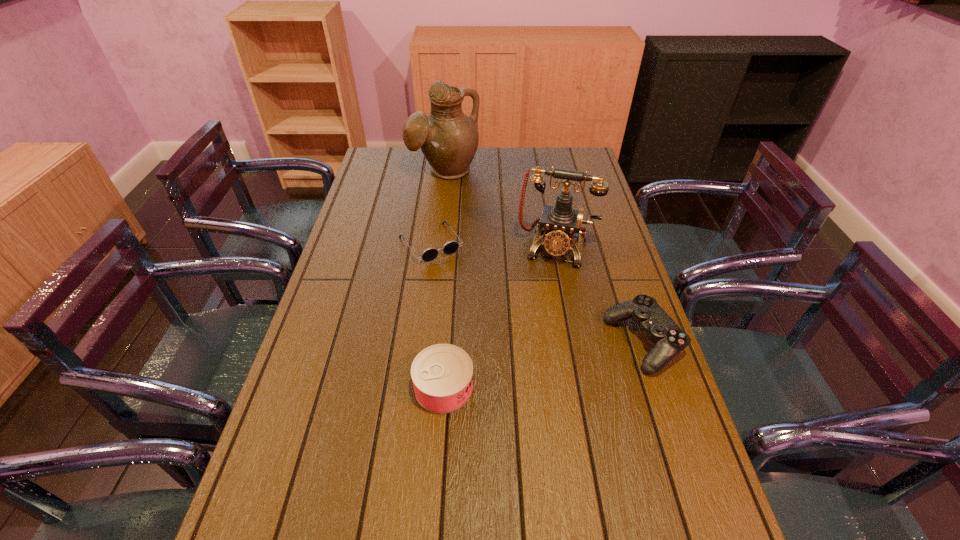
Locate an element on the screen. Image resolution: width=960 pixels, height=540 pixels. free space on the desktop that is between the can and the control and is positioned on the front of the fourth shortest object, featuring the rotary dial is located at coordinates (528, 369).

What are the coordinates of `free space on the desktop that is between the can and the control and is positioned at the spout of the tallest object` in the screenshot? It's located at (567, 360).

This screenshot has height=540, width=960. In order to click on free spot on the desktop that is between the can and the control and is positioned on the front-facing side of the shortest object in this screenshot , I will do `click(520, 370)`.